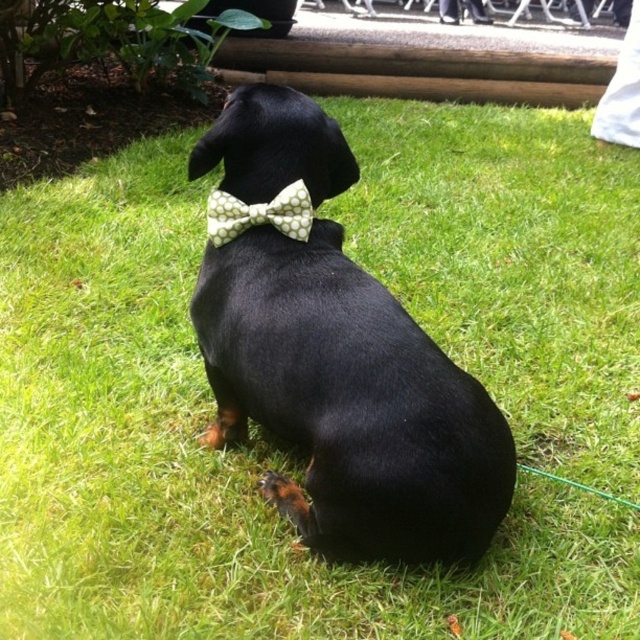
Consider the image. You are standing at the position of the black dog with the light green bow tie. You see two points marked in the image. Which point is closer to you, point A at coordinates point A is point (257, 282) and point B is point (237, 234)?

Point A at coordinates point A is point (257, 282) is closer to you because it is in front of point B at coordinates point B is point (237, 234).

You are a photographer trying to capture the black dog with both bow ties visible. Since the dog is facing away, you need to ensure both the black matte bow tie at center and the green dotted bow tie at center are in frame. Which bow tie will appear wider in the photo?

The black matte bow tie at center will appear wider in the photo because its width is larger than the green dotted bow tie at center according to the description.